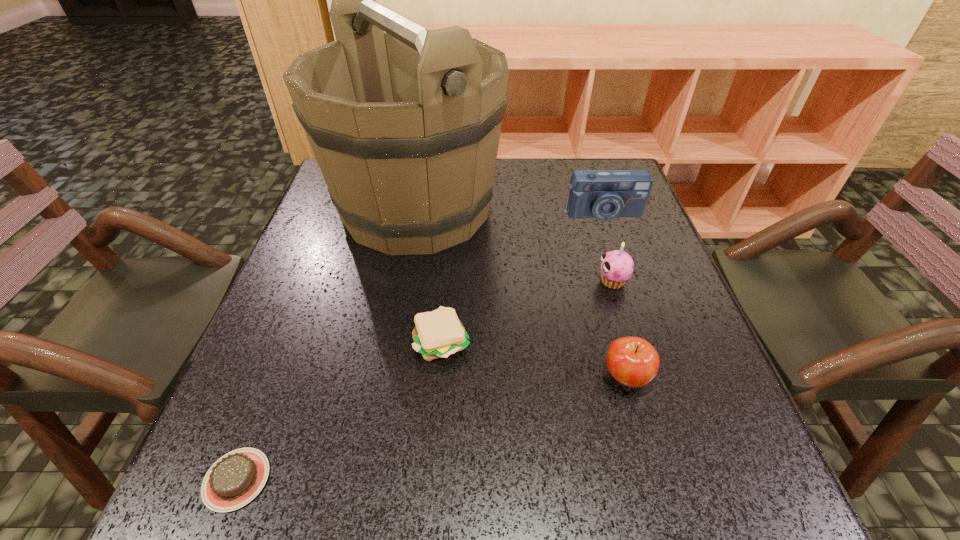
Locate an element on the screen. free space between the fifth tallest object and the apple is located at coordinates (534, 359).

Locate an element on the screen. vacant space that is in between the apple and the camera is located at coordinates (x=614, y=295).

Identify the location of blank region between the fourth nearest object and the bucket. This screenshot has height=540, width=960. (515, 245).

Where is `vacant space that is in between the camera and the bucket`? The height and width of the screenshot is (540, 960). vacant space that is in between the camera and the bucket is located at coordinates (510, 211).

I want to click on free space that is in between the shortest object and the patty, so click(x=339, y=410).

Locate an element on the screen. The width and height of the screenshot is (960, 540). empty space that is in between the bucket and the shortest object is located at coordinates (326, 344).

Locate an element on the screen. free space between the fourth tallest object and the patty is located at coordinates (534, 359).

At what (x,y) coordinates should I click in order to perform the action: click on empty location between the nearest object and the patty. Please return your answer as a coordinate pair (x, y). The image size is (960, 540). Looking at the image, I should click on (339, 410).

Identify which object is located as the fifth nearest to the patty. Please provide its 2D coordinates. Your answer should be formatted as a tuple, i.e. [(x, y)], where the tuple contains the x and y coordinates of a point satisfying the conditions above.

[(605, 195)]

Locate which object is the fourth closest to the camera. Please provide its 2D coordinates. Your answer should be formatted as a tuple, i.e. [(x, y)], where the tuple contains the x and y coordinates of a point satisfying the conditions above.

[(632, 361)]